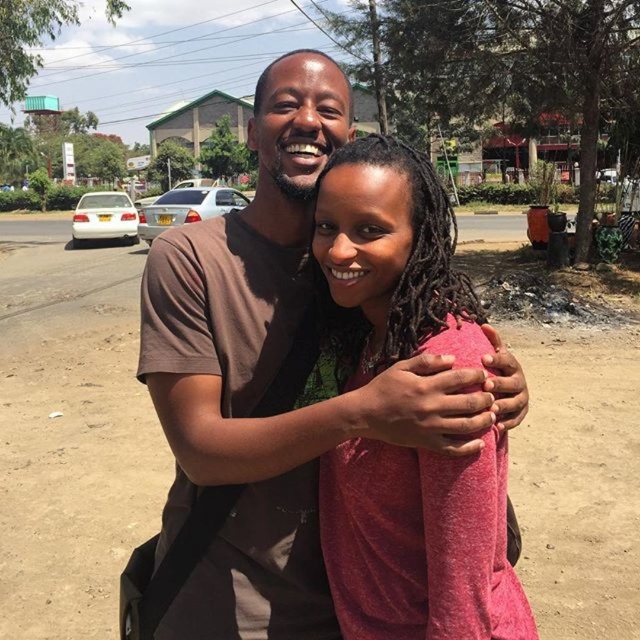
You are standing in the street scene with parked cars and trees. You see a point marked at coordinates (273,385). What object is located at that point?

The point at coordinates (273,385) indicates the brown cotton shirt at center.

You are a photographer trying to capture a candid shot of both the brown cotton shirt at center and the matte pink shirt at center. Since you can only focus on one subject at a time, which one should you focus on first to ensure the other is still in frame?

The brown cotton shirt at center is located above the matte pink shirt at center, so focusing on the brown cotton shirt at center first ensures the matte pink shirt at center remains in the lower part of the frame.

Based on the scene description, where is the brown cotton shirt at center positioned in relation to the silver car?

The brown cotton shirt at center is located at point [273,385], which is to the left of the silver car.